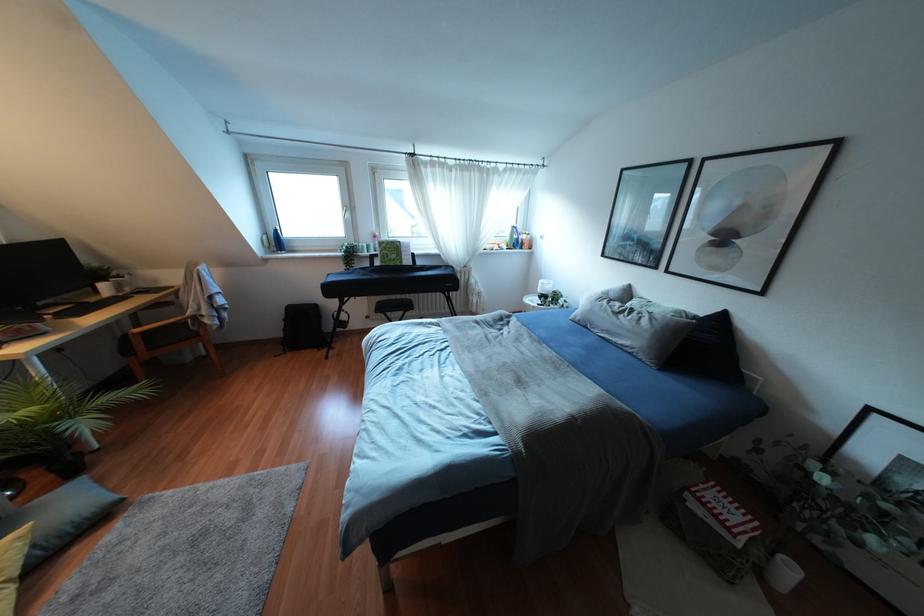
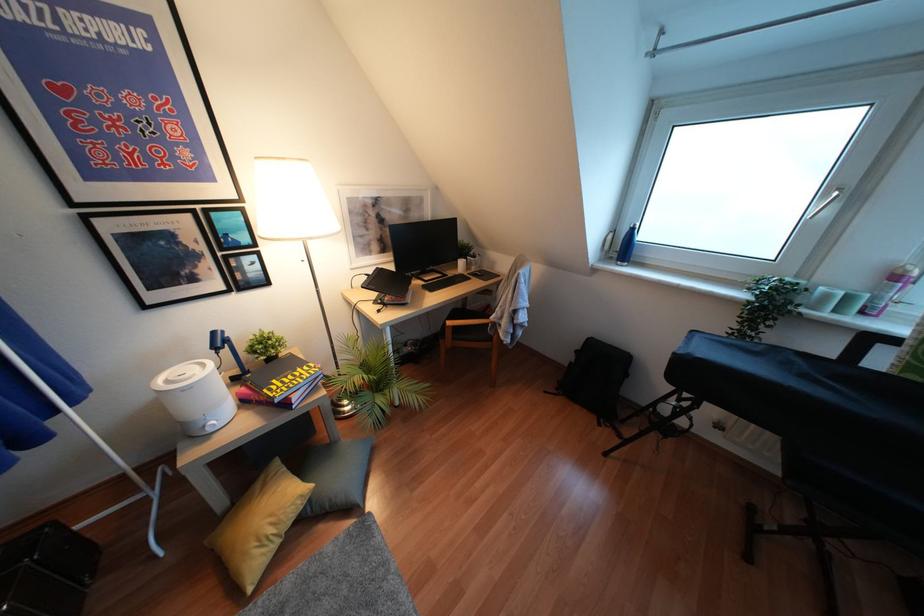
Where in the second image is the point corresponding to (32,546) from the first image?

(310, 500)